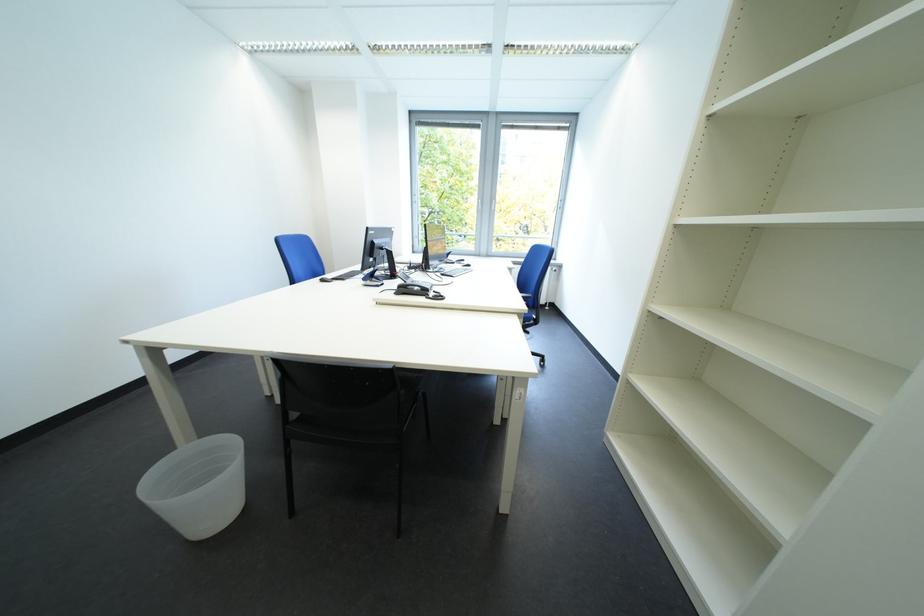
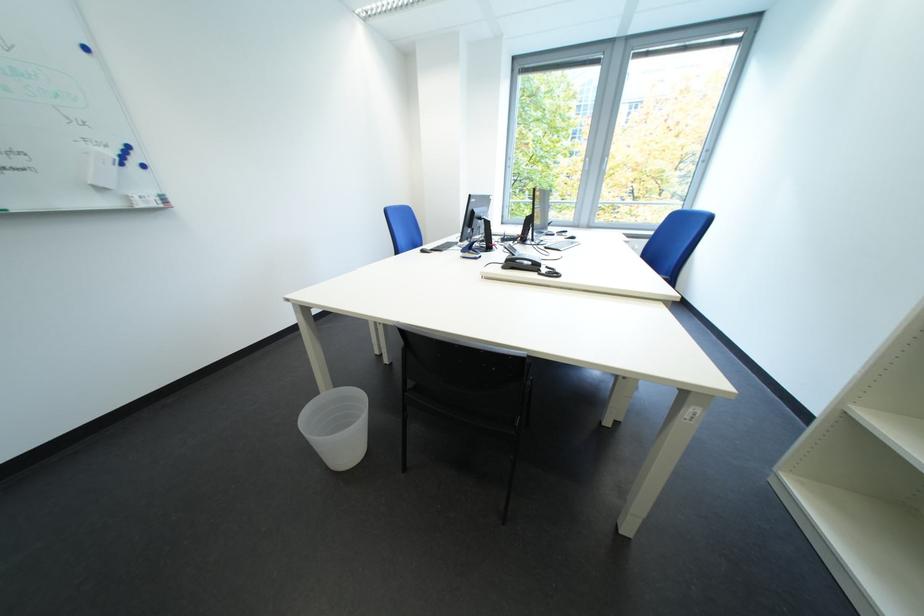
Find the pixel in the second image that matches (220,485) in the first image.

(354, 429)